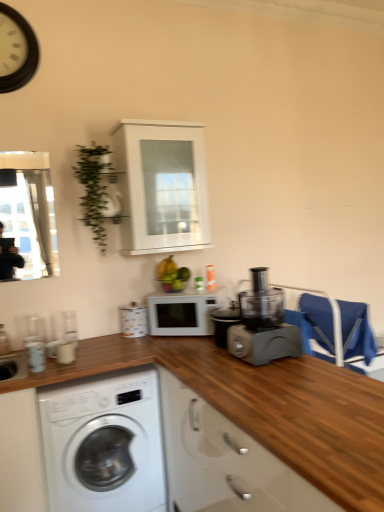
Image resolution: width=384 pixels, height=512 pixels. I want to click on unoccupied area in front of matte plastic food processor at center-right, so click(273, 379).